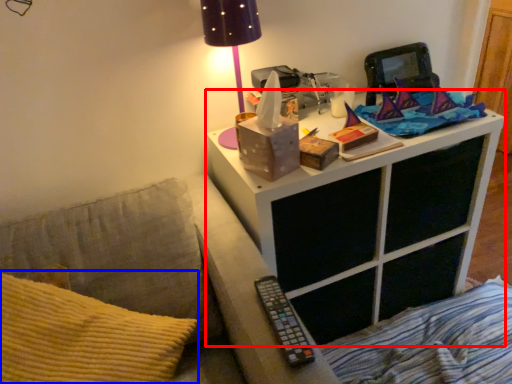
Question: Among these objects, which one is nearest to the camera, nightstand (highlighted by a red box) or throw pillow (highlighted by a blue box)?

Choices:
 (A) nightstand
 (B) throw pillow

Answer: (B)